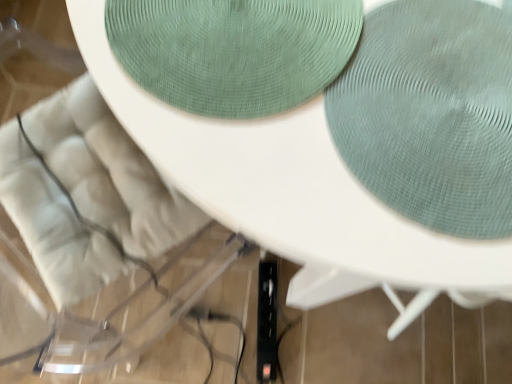
Locate an element on the screen. The height and width of the screenshot is (384, 512). green textured placemat at upper center is located at coordinates (234, 51).

What do you see at coordinates (234, 51) in the screenshot? I see `green textured placemat at upper center` at bounding box center [234, 51].

The width and height of the screenshot is (512, 384). What do you see at coordinates (109, 172) in the screenshot? I see `white fabric swivel chair at upper left` at bounding box center [109, 172].

Identify the location of white fabric swivel chair at upper left. Image resolution: width=512 pixels, height=384 pixels. (109, 172).

The height and width of the screenshot is (384, 512). Identify the location of green textured placemat at upper center. pos(234,51).

Which object is positioned more to the right, green textured placemat at upper center or white fabric swivel chair at upper left?

green textured placemat at upper center.

Is green textured placemat at upper center positioned behind white fabric swivel chair at upper left?

No, green textured placemat at upper center is closer to the viewer.

Is point (153, 44) positioned before point (85, 146)?

Yes.

From the image's perspective, is green textured placemat at upper center beneath white fabric swivel chair at upper left?

No, from the image's perspective, green textured placemat at upper center is not below white fabric swivel chair at upper left.

From a real-world perspective, between green textured placemat at upper center and white fabric swivel chair at upper left, who is vertically higher?

From a 3D spatial view, green textured placemat at upper center is above.

Does green textured placemat at upper center have a lesser width compared to white fabric swivel chair at upper left?

Correct, the width of green textured placemat at upper center is less than that of white fabric swivel chair at upper left.

Does green textured placemat at upper center have a lesser height compared to white fabric swivel chair at upper left?

Yes, green textured placemat at upper center is shorter than white fabric swivel chair at upper left.

Considering the relative sizes of green textured placemat at upper center and white fabric swivel chair at upper left in the image provided, is green textured placemat at upper center smaller than white fabric swivel chair at upper left?

Indeed, green textured placemat at upper center has a smaller size compared to white fabric swivel chair at upper left.

Is green textured placemat at upper center positioned beyond the bounds of white fabric swivel chair at upper left?

Yes, green textured placemat at upper center is outside of white fabric swivel chair at upper left.

Is green textured placemat at upper center touching white fabric swivel chair at upper left?

No, green textured placemat at upper center is not in contact with white fabric swivel chair at upper left.

Is green textured placemat at upper center oriented away from white fabric swivel chair at upper left?

No, green textured placemat at upper center's orientation is not away from white fabric swivel chair at upper left.

Measure the distance between green textured placemat at upper center and white fabric swivel chair at upper left.

10.28 inches.

Identify the location of oval that is above the white fabric swivel chair at upper left (from a real-world perspective). (234, 51).

Considering the relative positions of white fabric swivel chair at upper left and green textured placemat at upper center in the image provided, is white fabric swivel chair at upper left to the right of green textured placemat at upper center from the viewer's perspective?

No.

Based on the photo, which is in front, white fabric swivel chair at upper left or green textured placemat at upper center?

green textured placemat at upper center is in front.

Is point (69, 319) farther from viewer compared to point (355, 10)?

Yes, point (69, 319) is behind point (355, 10).

From the image's perspective, is white fabric swivel chair at upper left beneath green textured placemat at upper center?

Yes, from the image's perspective, white fabric swivel chair at upper left is below green textured placemat at upper center.

From a real-world perspective, which object rests below the other?

white fabric swivel chair at upper left.

In terms of width, does white fabric swivel chair at upper left look wider or thinner when compared to green textured placemat at upper center?

In the image, white fabric swivel chair at upper left appears to be wider than green textured placemat at upper center.

Considering the relative sizes of white fabric swivel chair at upper left and green textured placemat at upper center in the image provided, is white fabric swivel chair at upper left taller than green textured placemat at upper center?

Indeed, white fabric swivel chair at upper left has a greater height compared to green textured placemat at upper center.

Considering the relative sizes of white fabric swivel chair at upper left and green textured placemat at upper center in the image provided, is white fabric swivel chair at upper left bigger than green textured placemat at upper center?

Correct, white fabric swivel chair at upper left is larger in size than green textured placemat at upper center.

Is white fabric swivel chair at upper left not within green textured placemat at upper center?

Yes.

Are white fabric swivel chair at upper left and green textured placemat at upper center making contact?

No, white fabric swivel chair at upper left is not next to green textured placemat at upper center.

Does white fabric swivel chair at upper left turn towards green textured placemat at upper center?

No, white fabric swivel chair at upper left is not oriented towards green textured placemat at upper center.

How many degrees apart are the facing directions of white fabric swivel chair at upper left and green textured placemat at upper center?

163 degrees.

I want to click on oval in front of the white fabric swivel chair at upper left, so click(234, 51).

Where is `oval on the right of the white fabric swivel chair at upper left`? The width and height of the screenshot is (512, 384). oval on the right of the white fabric swivel chair at upper left is located at coordinates (234, 51).

Identify the location of swivel chair below the green textured placemat at upper center (from a real-world perspective). (109, 172).